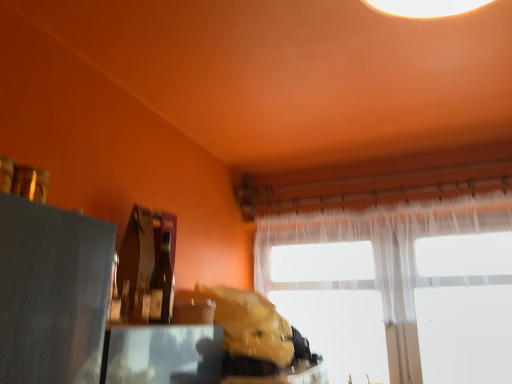
Question: Would you consider matte black table at lower left to be distant from leather-like brown bag at center?

Choices:
 (A) no
 (B) yes

Answer: (A)

Question: From a real-world perspective, is matte black table at lower left on top of leather-like brown bag at center?

Choices:
 (A) no
 (B) yes

Answer: (A)

Question: From the image's perspective, would you say matte black table at lower left is shown under leather-like brown bag at center?

Choices:
 (A) yes
 (B) no

Answer: (B)

Question: Is matte black table at lower left further to the viewer compared to leather-like brown bag at center?

Choices:
 (A) no
 (B) yes

Answer: (A)

Question: Is matte black table at lower left outside of leather-like brown bag at center?

Choices:
 (A) yes
 (B) no

Answer: (A)

Question: Is matte black table at lower left taller than leather-like brown bag at center?

Choices:
 (A) yes
 (B) no

Answer: (B)

Question: Considering the relative sizes of matte glass bottle at center and translucent fabric window at center in the image provided, is matte glass bottle at center thinner than translucent fabric window at center?

Choices:
 (A) yes
 (B) no

Answer: (B)

Question: Is matte glass bottle at center looking in the opposite direction of translucent fabric window at center?

Choices:
 (A) no
 (B) yes

Answer: (A)

Question: Is translucent fabric window at center inside matte glass bottle at center?

Choices:
 (A) yes
 (B) no

Answer: (B)

Question: Can you confirm if matte glass bottle at center is taller than translucent fabric window at center?

Choices:
 (A) no
 (B) yes

Answer: (A)

Question: Is matte glass bottle at center to the left of translucent fabric window at center from the viewer's perspective?

Choices:
 (A) yes
 (B) no

Answer: (A)

Question: Is matte glass bottle at center facing towards translucent fabric window at center?

Choices:
 (A) no
 (B) yes

Answer: (A)

Question: From the image's perspective, is leather-like brown bag at center located above matte black table at lower left?

Choices:
 (A) no
 (B) yes

Answer: (A)